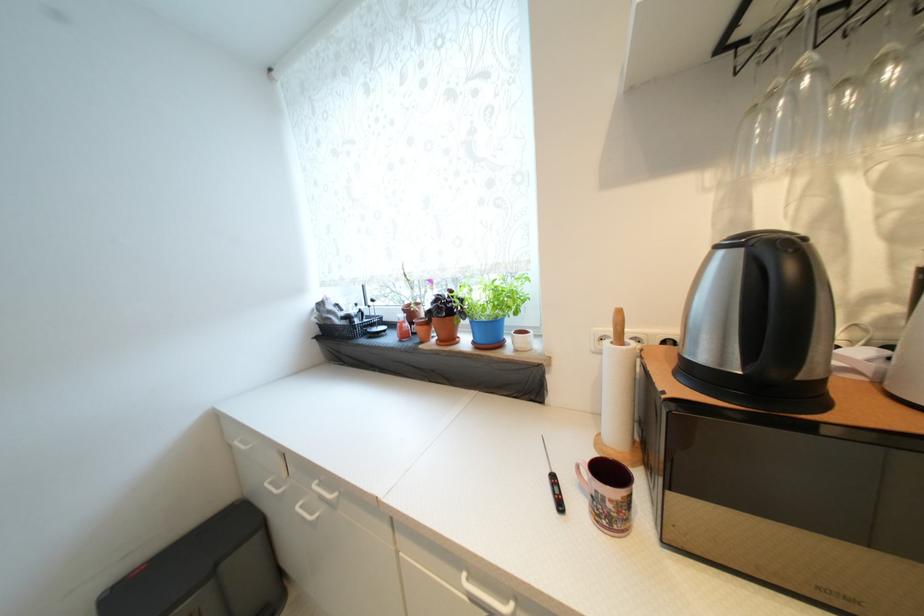
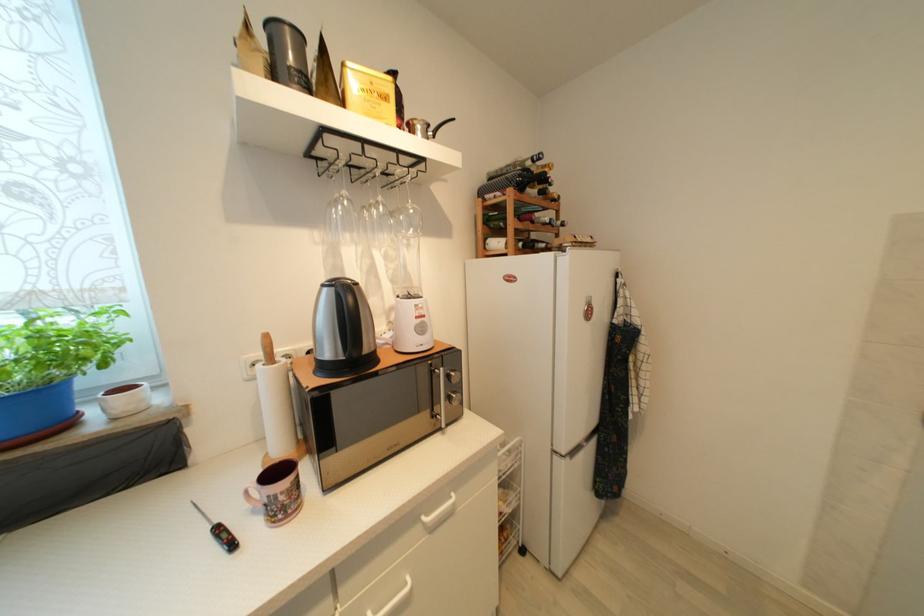
Question: The camera is either moving clockwise (left) or counter-clockwise (right) around the object. The first image is from the beginning of the video and the second image is from the end. Is the camera moving left or right when shooting the video?

Choices:
 (A) Left
 (B) Right

Answer: (A)